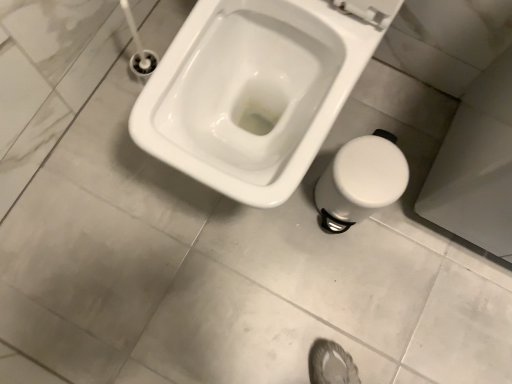
In order to click on blank space situated above white plastic bidet at lower right (from a real-world perspective) in this screenshot , I will do (367, 173).